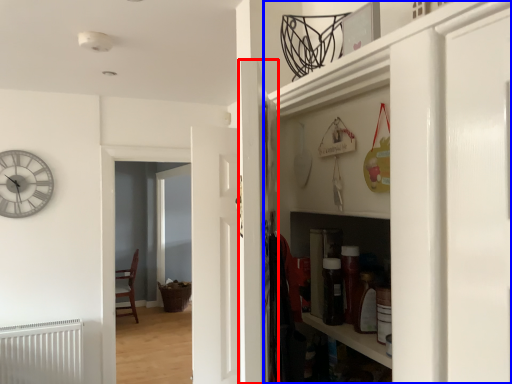
Question: Among these objects, which one is nearest to the camera, door (highlighted by a red box) or cabinetry (highlighted by a blue box)?

Choices:
 (A) door
 (B) cabinetry

Answer: (B)